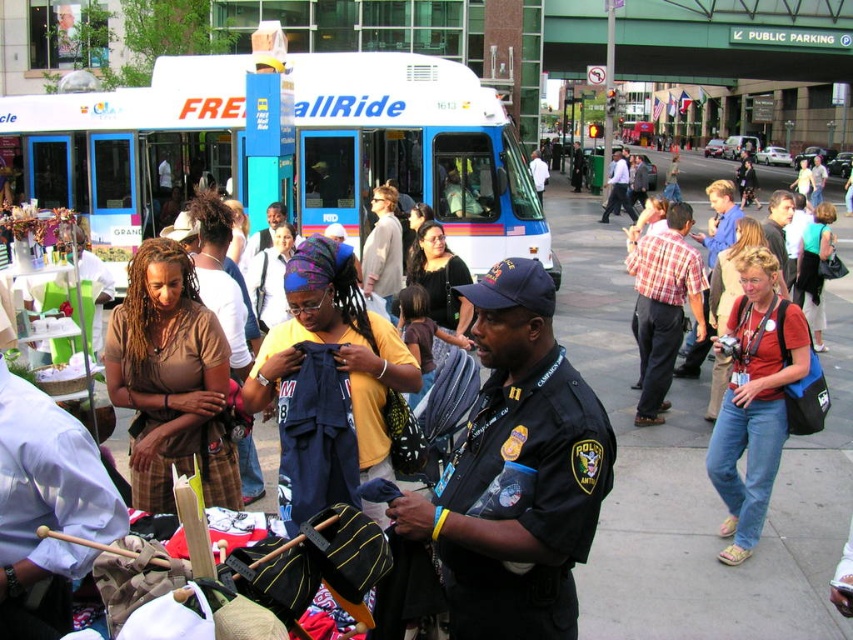
You are a pedestrian trying to cross the street where the white plastic bus at center and the black uniform at center are located. Which object is closer to the road?

The white plastic bus at center is positioned over the black uniform at center, meaning it is closer to the road than the black uniform at center.

You are a pedestrian standing on the sidewalk and want to walk from the brown cotton shirt at left to the white plastic bus at center. Is there any obstacle in your path?

The white plastic bus at center is above the brown cotton shirt at left, so there is no obstacle in your path between them.

You are a photographer trying to capture a clear shot of both the yellow cotton shirt at center and the red shirt at center. Since you want to focus on the shirts, you need to adjust your camera so that the shorter one is fully visible without being cut off. Which shirt should you ensure is positioned lower in the frame?

The yellow cotton shirt at center is shorter than the red shirt at center, so you should ensure the yellow cotton shirt at center is positioned lower in the frame to avoid being cut off when focusing on the shirts.